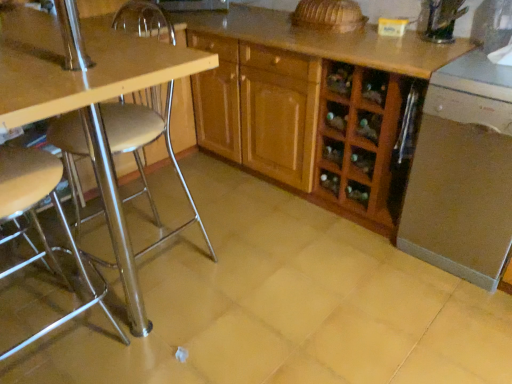
Question: Could you tell me if metallic silver stool at left is turned towards satin silver dishwasher at lower right?

Choices:
 (A) no
 (B) yes

Answer: (A)

Question: Is the depth of metallic silver stool at left greater than that of satin silver dishwasher at lower right?

Choices:
 (A) yes
 (B) no

Answer: (B)

Question: Is metallic silver stool at left thinner than satin silver dishwasher at lower right?

Choices:
 (A) no
 (B) yes

Answer: (B)

Question: Does metallic silver stool at left appear on the right side of satin silver dishwasher at lower right?

Choices:
 (A) yes
 (B) no

Answer: (B)

Question: From a real-world perspective, does metallic silver stool at left stand above satin silver dishwasher at lower right?

Choices:
 (A) no
 (B) yes

Answer: (B)

Question: From the image's perspective, relative to metallic silver stool at left, is wooden cabinet at center above or below?

Choices:
 (A) below
 (B) above

Answer: (B)

Question: Considering their positions, is wooden cabinet at center located in front of or behind metallic silver stool at left?

Choices:
 (A) behind
 (B) front

Answer: (A)

Question: In terms of width, does wooden cabinet at center look wider or thinner when compared to metallic silver stool at left?

Choices:
 (A) wide
 (B) thin

Answer: (A)

Question: From a real-world perspective, is wooden cabinet at center positioned above or below metallic silver stool at left?

Choices:
 (A) above
 (B) below

Answer: (B)

Question: From the image's perspective, is metallic silver stool at left positioned above or below metallic silver stool at left?

Choices:
 (A) above
 (B) below

Answer: (A)

Question: From a real-world perspective, is metallic silver stool at left physically located above or below metallic silver stool at left?

Choices:
 (A) below
 (B) above

Answer: (B)

Question: Considering the positions of metallic silver stool at left and metallic silver stool at left in the image, is metallic silver stool at left bigger or smaller than metallic silver stool at left?

Choices:
 (A) big
 (B) small

Answer: (B)

Question: Is point (69, 155) closer or farther from the camera than point (31, 180)?

Choices:
 (A) closer
 (B) farther

Answer: (B)

Question: Considering the positions of wooden cabinet at center and metallic silver stool at left in the image, is wooden cabinet at center wider or thinner than metallic silver stool at left?

Choices:
 (A) thin
 (B) wide

Answer: (B)

Question: Is wooden cabinet at center to the left or to the right of metallic silver stool at left in the image?

Choices:
 (A) right
 (B) left

Answer: (A)